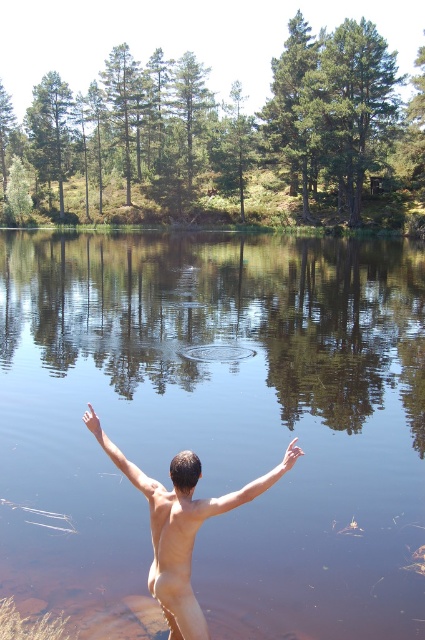
Question: Based on their relative distances, which object is farther from the skinny nude man at center?

Choices:
 (A) skinny flesh at upper center
 (B) skinny tan arm at center

Answer: (B)

Question: Which point is farther to the camera?

Choices:
 (A) skinny flesh at upper center
 (B) skinny tan arm at center

Answer: (A)

Question: Does transparent water at center have a greater width compared to skinny tan arm at center?

Choices:
 (A) no
 (B) yes

Answer: (B)

Question: Can you confirm if transparent water at center is bigger than skinny tan arm at center?

Choices:
 (A) yes
 (B) no

Answer: (A)

Question: Estimate the real-world distances between objects in this image. Which object is closer to the transparent water at center?

Choices:
 (A) skinny nude man at center
 (B) skinny flesh at upper center
 (C) skinny tan arm at center

Answer: (A)

Question: Is transparent water at center closer to the viewer compared to skinny tan arm at center?

Choices:
 (A) no
 (B) yes

Answer: (A)